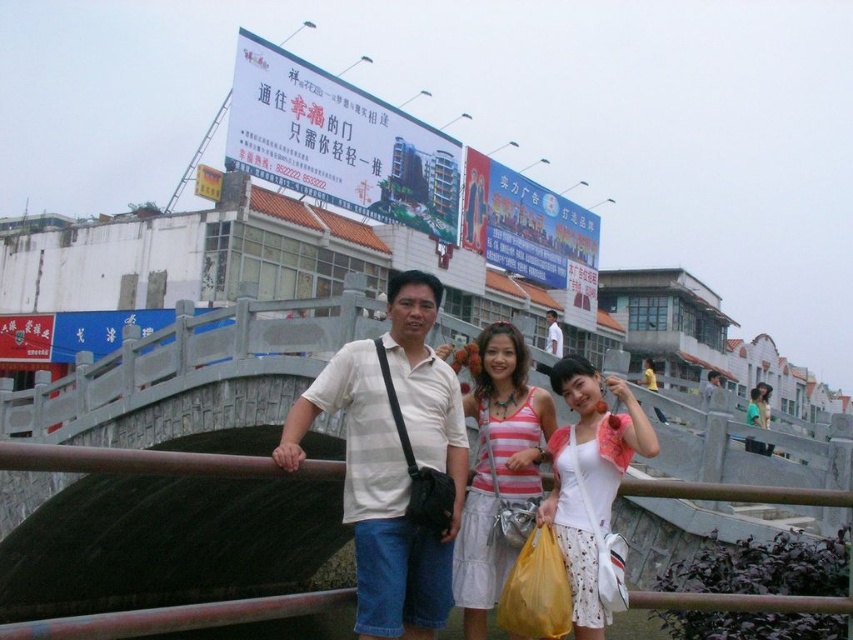
The height and width of the screenshot is (640, 853). What do you see at coordinates (173, 618) in the screenshot? I see `metallic gray railing at center` at bounding box center [173, 618].

Measure the distance between metallic gray railing at center and camera.

metallic gray railing at center and camera are 17.80 meters apart.

The height and width of the screenshot is (640, 853). Find the location of `metallic gray railing at center`. metallic gray railing at center is located at coordinates (173, 618).

Can you confirm if white striped shirt at center is bigger than matte white tank top at center?

Actually, white striped shirt at center might be smaller than matte white tank top at center.

Does white striped shirt at center appear on the right side of matte white tank top at center?

In fact, white striped shirt at center is to the left of matte white tank top at center.

Locate an element on the screen. The height and width of the screenshot is (640, 853). white striped shirt at center is located at coordinates (392, 461).

Does white striped shirt at center have a lesser height compared to metallic gray railing at center?

Correct, white striped shirt at center is not as tall as metallic gray railing at center.

Consider the image. Which of these two, white striped shirt at center or metallic gray railing at center, stands shorter?

With less height is white striped shirt at center.

Identify the location of white striped shirt at center. The height and width of the screenshot is (640, 853). (392, 461).

You are a GUI agent. You are given a task and a screenshot of the screen. Output one action in this format:
    pyautogui.click(x=<x>, y=<y>)
    Task: Click on the white striped shirt at center
    Image resolution: width=853 pixels, height=640 pixels.
    Given the screenshot: What is the action you would take?
    pyautogui.click(x=392, y=461)